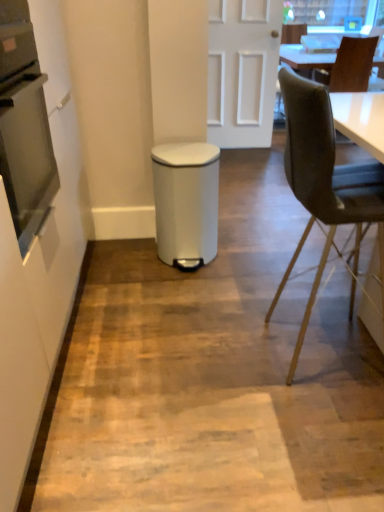
You are a GUI agent. You are given a task and a screenshot of the screen. Output one action in this format:
    pyautogui.click(x=<x>, y=<y>)
    Task: Click on the free space to the left of velvet black chair at right, positioned as the first chair in front-to-back order
    The image size is (384, 512).
    Given the screenshot: What is the action you would take?
    pyautogui.click(x=216, y=348)